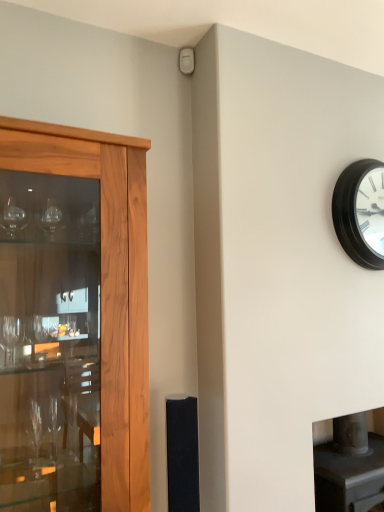
The width and height of the screenshot is (384, 512). Describe the element at coordinates (108, 286) in the screenshot. I see `wooden cabinet at left` at that location.

The image size is (384, 512). Describe the element at coordinates (361, 212) in the screenshot. I see `black matte clock at upper right` at that location.

I want to click on wooden cabinet at left, so click(108, 286).

Is wooden cabinet at left thinner than black matte speaker at center?

No, wooden cabinet at left is not thinner than black matte speaker at center.

Between wooden cabinet at left and black matte speaker at center, which one has larger size?

Bigger between the two is wooden cabinet at left.

From a real-world perspective, is wooden cabinet at left above or below black matte speaker at center?

In terms of real-world spatial position, wooden cabinet at left is above black matte speaker at center.

Considering the positions of objects wooden cabinet at left and black matte clock at upper right in the image provided, who is behind, wooden cabinet at left or black matte clock at upper right?

black matte clock at upper right is behind.

Is there a large distance between wooden cabinet at left and black matte clock at upper right?

Indeed, wooden cabinet at left is not near black matte clock at upper right.

Does wooden cabinet at left turn towards black matte clock at upper right?

No, wooden cabinet at left is not aimed at black matte clock at upper right.

From a real-world perspective, is wooden cabinet at left located higher than black matte clock at upper right?

No.

From a real-world perspective, is black matte clock at upper right positioned over wooden cabinet at left based on gravity?

Indeed, from a real-world perspective, black matte clock at upper right stands above wooden cabinet at left.

Is black matte clock at upper right smaller than wooden cabinet at left?

Indeed, black matte clock at upper right has a smaller size compared to wooden cabinet at left.

From the image's perspective, does black matte clock at upper right appear higher than wooden cabinet at left?

Yes, from the image's perspective, black matte clock at upper right is over wooden cabinet at left.

Is black matte clock at upper right further to the viewer compared to wooden cabinet at left?

Yes, it is.

Considering the sizes of objects black matte speaker at center and wooden cabinet at left in the image provided, who is smaller, black matte speaker at center or wooden cabinet at left?

With smaller size is black matte speaker at center.

Measure the distance between black matte speaker at center and wooden cabinet at left.

black matte speaker at center is 15.93 inches from wooden cabinet at left.

Does black matte speaker at center turn towards wooden cabinet at left?

No, black matte speaker at center is not aimed at wooden cabinet at left.

From a real-world perspective, is black matte speaker at center on wooden cabinet at left?

No, from a real-world perspective, black matte speaker at center is not on top of wooden cabinet at left.

Does point (356, 217) come behind point (186, 438)?

Yes, it is behind point (186, 438).

Is black matte clock at upper right to the right of black matte speaker at center from the viewer's perspective?

Yes.

Considering the relative positions of black matte clock at upper right and black matte speaker at center in the image provided, is black matte clock at upper right behind black matte speaker at center?

Yes, black matte clock at upper right is behind black matte speaker at center.

Is black matte clock at upper right located outside black matte speaker at center?

black matte clock at upper right lies outside black matte speaker at center's area.

Could you tell me if black matte speaker at center is facing black matte clock at upper right?

No, black matte speaker at center is not turned towards black matte clock at upper right.

Which of these two, black matte speaker at center or black matte clock at upper right, stands shorter?

Standing shorter between the two is black matte speaker at center.

From the image's perspective, who appears lower, black matte speaker at center or black matte clock at upper right?

black matte speaker at center is shown below in the image.

Considering the positions of point (173, 405) and point (354, 197), is point (173, 405) closer or farther from the camera than point (354, 197)?

Point (173, 405).

Find the location of `cupboard above the black matte speaker at center (from the image's perspective)`. cupboard above the black matte speaker at center (from the image's perspective) is located at coordinates (108, 286).

Where is `cupboard in front of the black matte clock at upper right`? cupboard in front of the black matte clock at upper right is located at coordinates (108, 286).

Looking at the image, which one is located further to black matte clock at upper right, wooden cabinet at left or black matte speaker at center?

Based on the image, black matte speaker at center appears to be further to black matte clock at upper right.

When comparing their distances from wooden cabinet at left, does black matte clock at upper right or black matte speaker at center seem closer?

Among the two, black matte speaker at center is located nearer to wooden cabinet at left.

From the image, which object appears to be farther from black matte speaker at center, black matte clock at upper right or wooden cabinet at left?

Among the two, black matte clock at upper right is located further to black matte speaker at center.

Based on their spatial positions, is black matte speaker at center or black matte clock at upper right closer to wooden cabinet at left?

black matte speaker at center lies closer to wooden cabinet at left than the other object.

From the image, which object appears to be nearer to black matte clock at upper right, black matte speaker at center or wooden cabinet at left?

wooden cabinet at left is positioned closer to the anchor black matte clock at upper right.

Estimate the real-world distances between objects in this image. Which object is closer to black matte speaker at center, wooden cabinet at left or black matte clock at upper right?

Answer: wooden cabinet at left is closer to black matte speaker at center.

Where is `speaker located between wooden cabinet at left and black matte clock at upper right in the left-right direction`? This screenshot has height=512, width=384. speaker located between wooden cabinet at left and black matte clock at upper right in the left-right direction is located at coordinates (182, 454).